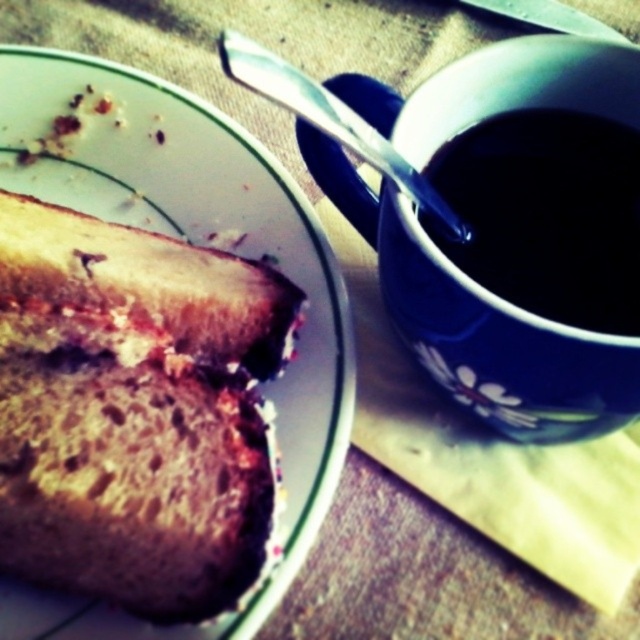
You are a waiter at a cafe and need to place a new order of coffee on the table. The customer specified that the coffee should be placed exactly 0.1 units to the right of the white glossy plate at upper left. Where should you place the coffee mug in terms of coordinates?

The white glossy plate at upper left is located at coordinates [195,243]. To place the coffee exactly 0.1 units to the right, you should position it at coordinates [195,307].

You are a barista who needs to place both the blue glossy mug at upper right and the brown crumbly bread at center into a dishwasher. The dishwasher has a height limit of 15 cm for items. Can you determine which item might exceed the height limit based on their sizes?

The blue glossy mug at upper right is taller than the brown crumbly bread at center. Since the dishwasher has a 15 cm height limit, if the mug exceeds 15 cm, it would be too tall. However, without specific measurements, we can only conclude the mug is taller than the bread, so it might be the one to check first.